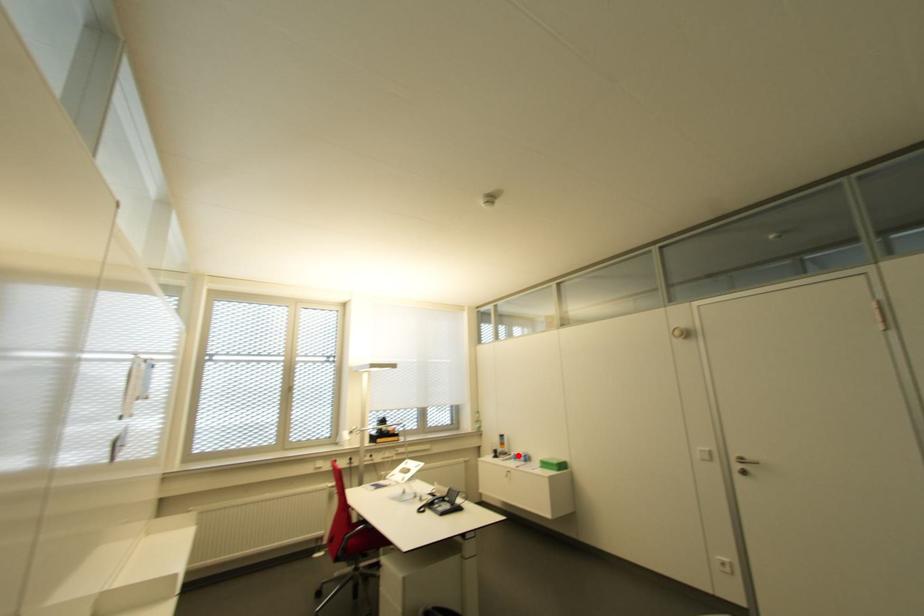
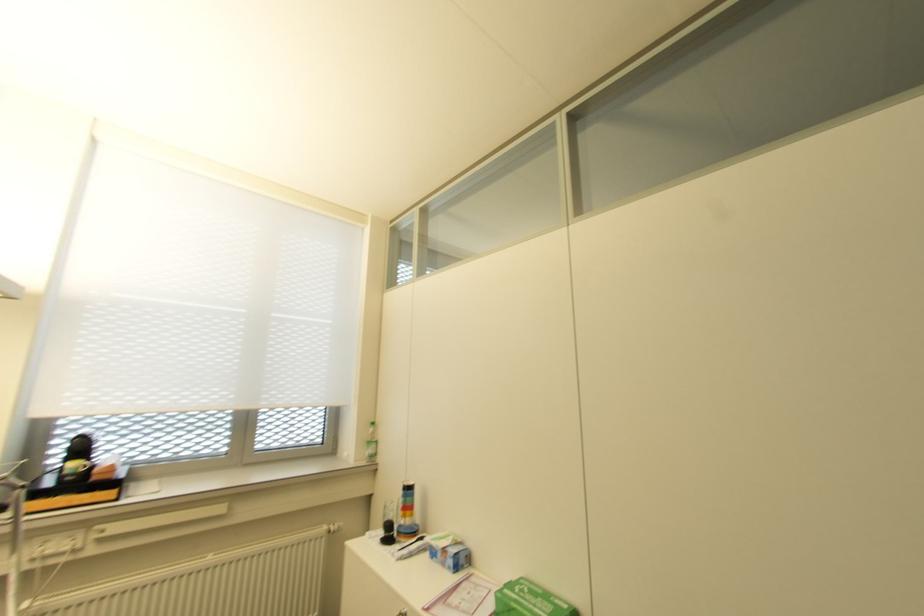
Find the pixel in the second image that matches the highlighted location in the first image.

(441, 549)